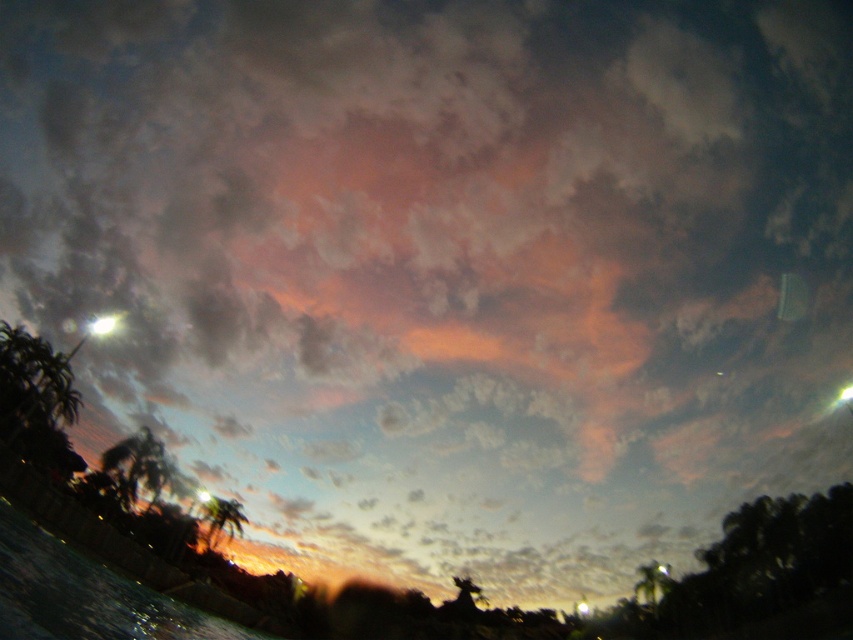
Question: Which object is positioned farthest from the green leafy palm tree at lower left?

Choices:
 (A) green leafy palm tree at lower center
 (B) translucent water at lower left

Answer: (B)

Question: Is green leafy palm tree at lower left bigger than green leafy palm tree at lower center?

Choices:
 (A) no
 (B) yes

Answer: (B)

Question: Is translucent water at lower left positioned at the back of green leafy palm tree at lower center?

Choices:
 (A) yes
 (B) no

Answer: (B)

Question: Does translucent water at lower left come behind green leafy palm tree at lower left?

Choices:
 (A) no
 (B) yes

Answer: (A)

Question: Which point is farther to the camera?

Choices:
 (A) translucent water at lower left
 (B) green leafy palm tree at lower center

Answer: (B)

Question: Which point is farther from the camera taking this photo?

Choices:
 (A) (109, 467)
 (B) (210, 536)

Answer: (B)